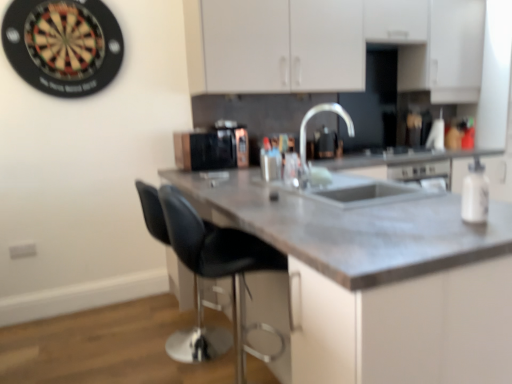
Question: From a real-world perspective, is white matte cabinet at upper center below black leather stool at center?

Choices:
 (A) yes
 (B) no

Answer: (B)

Question: Is white matte cabinet at upper center positioned far away from black leather stool at center?

Choices:
 (A) yes
 (B) no

Answer: (A)

Question: Is the surface of white matte cabinet at upper center in direct contact with black leather stool at center?

Choices:
 (A) no
 (B) yes

Answer: (A)

Question: Can you confirm if white matte cabinet at upper center is smaller than black leather stool at center?

Choices:
 (A) no
 (B) yes

Answer: (A)

Question: Considering the relative sizes of white matte cabinet at upper center and black leather stool at center in the image provided, is white matte cabinet at upper center shorter than black leather stool at center?

Choices:
 (A) no
 (B) yes

Answer: (B)

Question: From a real-world perspective, relative to white matte bottle at right, is black leather swivel chair at lower left vertically above or below?

Choices:
 (A) above
 (B) below

Answer: (B)

Question: From the image's perspective, is black leather swivel chair at lower left positioned above or below white matte bottle at right?

Choices:
 (A) below
 (B) above

Answer: (A)

Question: Considering the positions of black leather swivel chair at lower left and white matte bottle at right in the image, is black leather swivel chair at lower left wider or thinner than white matte bottle at right?

Choices:
 (A) thin
 (B) wide

Answer: (B)

Question: Is point (138, 180) closer or farther from the camera than point (474, 175)?

Choices:
 (A) farther
 (B) closer

Answer: (A)

Question: Would you say satin nickel faucet at center is to the left or to the right of black leather swivel chair at lower left in the picture?

Choices:
 (A) right
 (B) left

Answer: (A)

Question: Is satin nickel faucet at center bigger or smaller than black leather swivel chair at lower left?

Choices:
 (A) small
 (B) big

Answer: (A)

Question: Do you think satin nickel faucet at center is within black leather swivel chair at lower left, or outside of it?

Choices:
 (A) inside
 (B) outside

Answer: (B)

Question: Is satin nickel faucet at center wider or thinner than black leather swivel chair at lower left?

Choices:
 (A) wide
 (B) thin

Answer: (B)

Question: Is satin nickel faucet at center wider or thinner than white matte cabinet at upper center?

Choices:
 (A) wide
 (B) thin

Answer: (B)

Question: Which is correct: satin nickel faucet at center is inside white matte cabinet at upper center, or outside of it?

Choices:
 (A) outside
 (B) inside

Answer: (A)